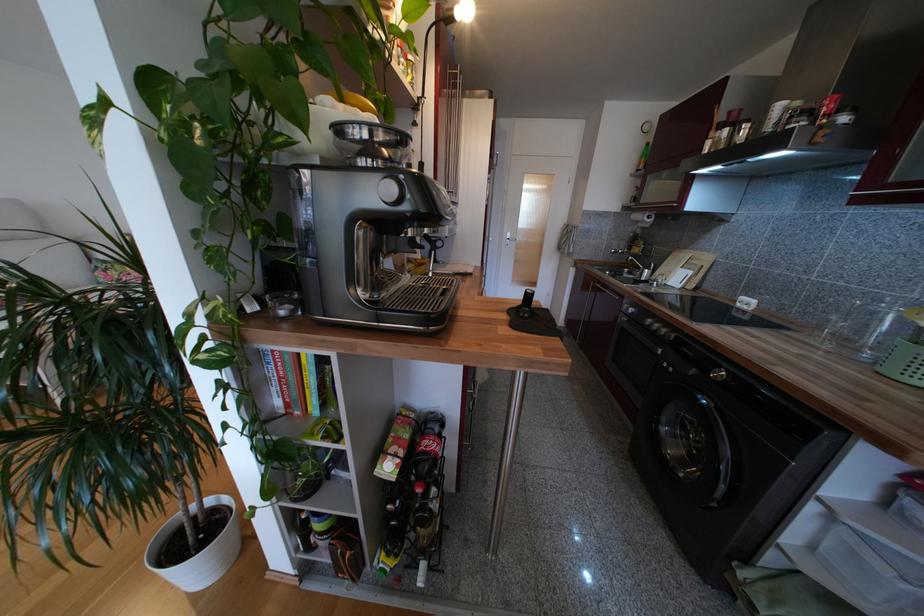
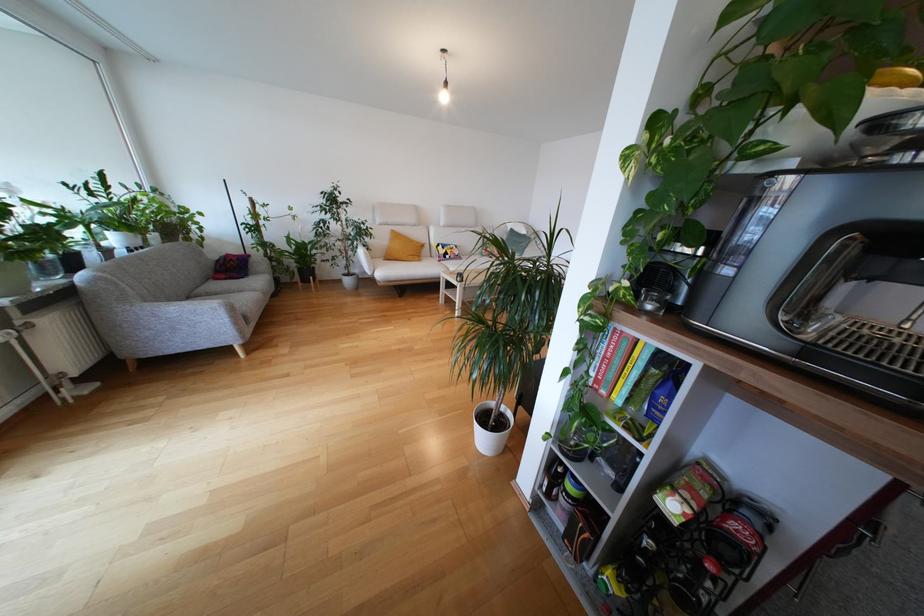
In the second image, find the point that corresponds to pixel 300 370 in the first image.

(630, 358)